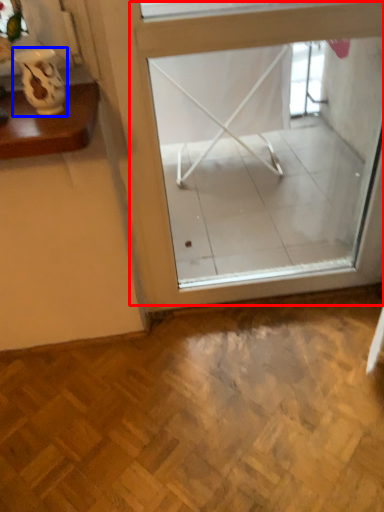
Question: Which object is closer to the camera taking this photo, window (highlighted by a red box) or vase (highlighted by a blue box)?

Choices:
 (A) window
 (B) vase

Answer: (B)